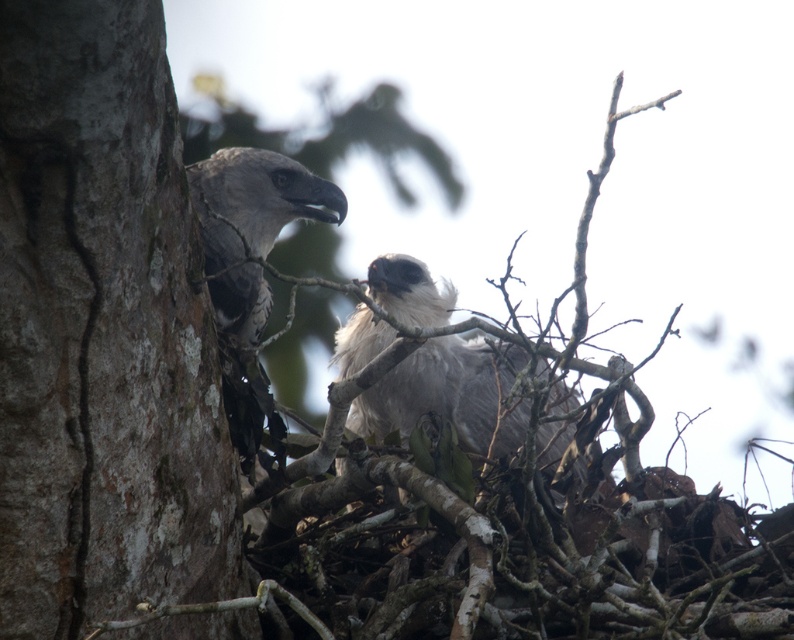
Question: Is rough bark tree trunk at left bigger than gray fluffy eagle at center?

Choices:
 (A) no
 (B) yes

Answer: (A)

Question: Which point is closer to the camera taking this photo?

Choices:
 (A) (126, 432)
 (B) (405, 273)

Answer: (A)

Question: Does rough bark tree trunk at left have a greater width compared to gray fluffy eagle at center?

Choices:
 (A) yes
 (B) no

Answer: (B)

Question: Which point appears farthest from the camera in this image?

Choices:
 (A) (414, 381)
 (B) (234, 545)

Answer: (A)

Question: Does rough bark tree trunk at left appear on the right side of gray fluffy eagle at center?

Choices:
 (A) yes
 (B) no

Answer: (B)